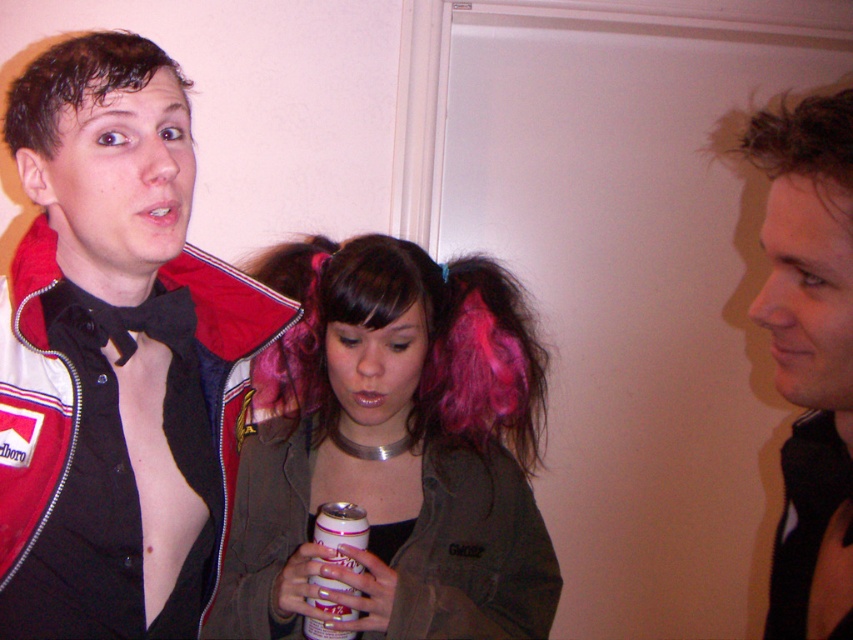
Question: Is pink hair at center positioned behind white plastic can at center?

Choices:
 (A) yes
 (B) no

Answer: (B)

Question: Is shiny black bow tie at center to the right of pink hair at center from the viewer's perspective?

Choices:
 (A) yes
 (B) no

Answer: (B)

Question: Which point is farther to the camera?

Choices:
 (A) smooth black shirt at center
 (B) pink hair at center
 (C) wet brown hair at left

Answer: (B)

Question: Which point is farther to the camera?

Choices:
 (A) (36, 333)
 (B) (97, 99)

Answer: (A)

Question: Does shiny black bow tie at center have a greater width compared to pink hair at center?

Choices:
 (A) yes
 (B) no

Answer: (B)

Question: Which point appears closest to the camera in this image?

Choices:
 (A) (323, 605)
 (B) (479, 522)
 (C) (109, 61)

Answer: (C)